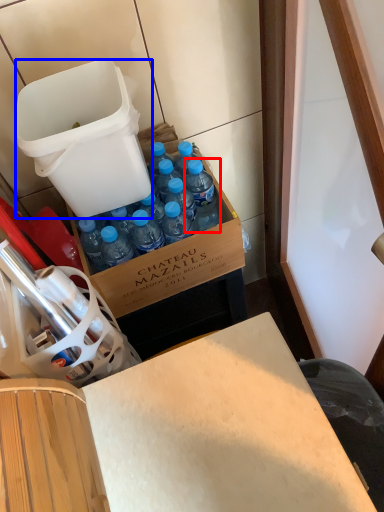
Question: Which object is further to the camera taking this photo, bottle (highlighted by a red box) or trash bin/can (highlighted by a blue box)?

Choices:
 (A) bottle
 (B) trash bin/can

Answer: (A)